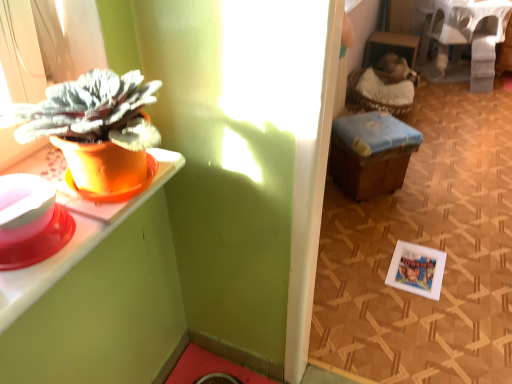
This screenshot has height=384, width=512. What are the coordinates of `vacant area that is situated to the right of wooden stool at center` in the screenshot? It's located at (442, 193).